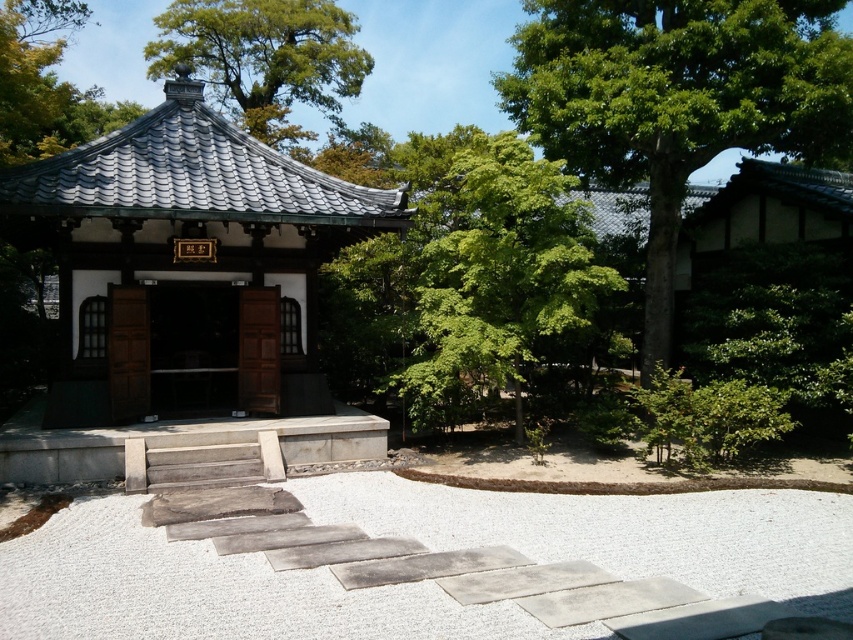
You are a visitor approaching the pavilion and notice the green leafy tree at upper center and the wooden door at center. Which object appears narrower from your perspective?

The green leafy tree at upper center appears narrower than the wooden door at center because it is thinner.